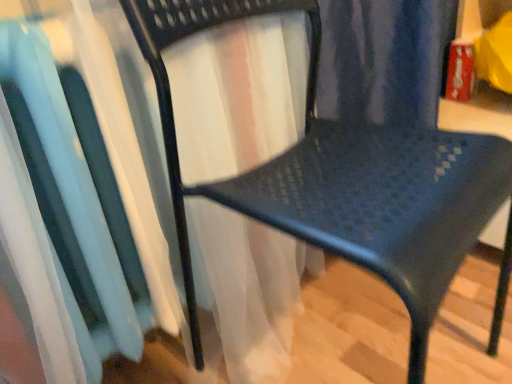
Question: Should I look upward or downward to see white sheer curtain at left?

Choices:
 (A) up
 (B) down

Answer: (B)